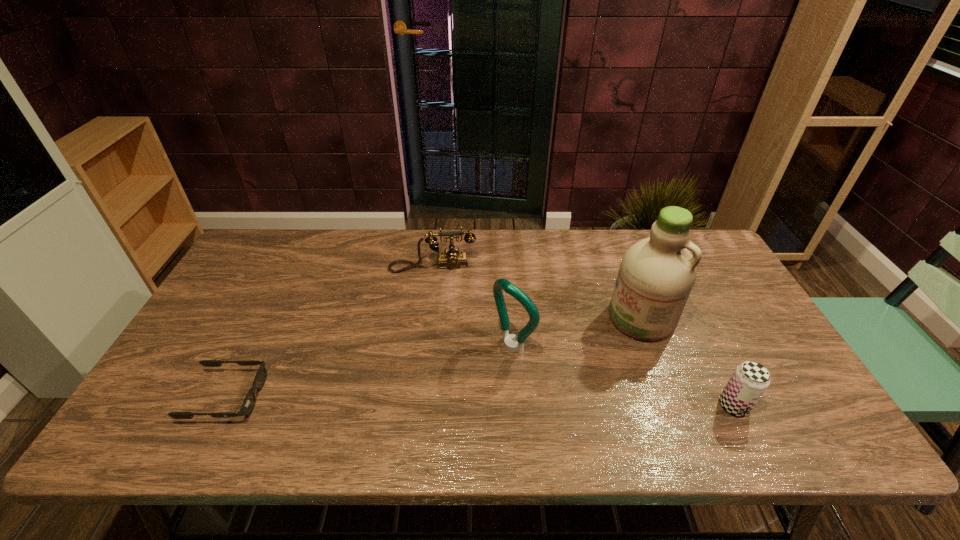
At what (x,y) coordinates should I click in order to perform the action: click on free space on the desktop that is between the sunglasses and the rightmost object and is positioned on the front-facing side of the telephone. Please return your answer as a coordinate pair (x, y). This screenshot has width=960, height=540. Looking at the image, I should click on point(436,401).

I want to click on free spot on the desktop that is between the sunglasses and the rightmost object and is positioned at the jaws of the third object from right to left, so click(x=438, y=401).

Image resolution: width=960 pixels, height=540 pixels. What are the coordinates of `vacant spot on the desktop that is between the sunglasses and the rightmost object and is positioned on the front label of the cleansing agent` in the screenshot? It's located at (530, 402).